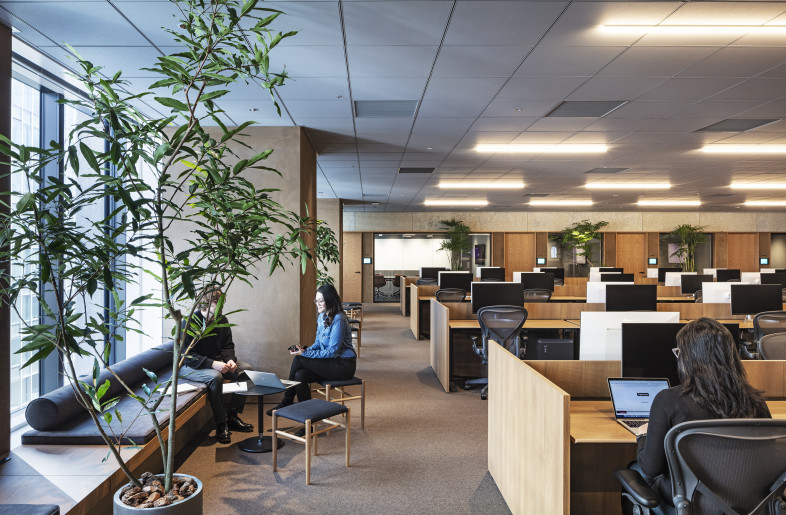
At what (x,y) coordinates should I click in order to perform the action: click on plant. Please return your answer as a coordinate pair (x, y). Image resolution: width=786 pixels, height=515 pixels. Looking at the image, I should click on (171, 477), (325, 279), (454, 238), (581, 236), (682, 242).